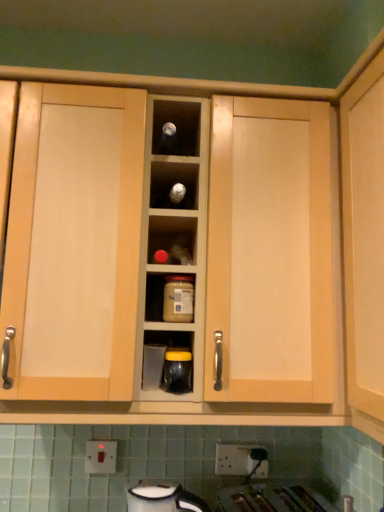
Question: From a real-world perspective, is matte plastic container at center, arranged as the second appliance when ordered from the bottom, on white plastic electric outlet at lower center, which appears as the 2th electric outlet when viewed from the left?

Choices:
 (A) no
 (B) yes

Answer: (B)

Question: Is matte plastic container at center, arranged as the second appliance when ordered from the bottom, completely or partially outside of white plastic electric outlet at lower center, which appears as the first electric outlet when viewed from the right?

Choices:
 (A) yes
 (B) no

Answer: (A)

Question: Is white plastic electric outlet at lower center, which appears as the 2th electric outlet when viewed from the left, completely or partially inside matte plastic container at center, arranged as the second appliance when ordered from the bottom?

Choices:
 (A) yes
 (B) no

Answer: (B)

Question: Does matte plastic container at center, arranged as the second appliance when ordered from the bottom, have a lesser height compared to white plastic electric outlet at lower center, which appears as the first electric outlet when viewed from the right?

Choices:
 (A) no
 (B) yes

Answer: (A)

Question: Are matte plastic container at center, arranged as the second appliance when ordered from the bottom, and white plastic electric outlet at lower center, which appears as the first electric outlet when viewed from the right, far apart?

Choices:
 (A) no
 (B) yes

Answer: (A)

Question: Considering the relative sizes of matte plastic container at center, the 2th appliance viewed from the top, and white plastic electric outlet at lower center, which appears as the first electric outlet when viewed from the right, in the image provided, is matte plastic container at center, the 2th appliance viewed from the top, bigger than white plastic electric outlet at lower center, which appears as the first electric outlet when viewed from the right,?

Choices:
 (A) no
 (B) yes

Answer: (B)

Question: Is light wood cabinet at center aimed at white glossy kettle at lower center, the third appliance in the top-to-bottom sequence?

Choices:
 (A) no
 (B) yes

Answer: (A)

Question: From the image's perspective, would you say light wood cabinet at center is shown under white glossy kettle at lower center, the third appliance in the top-to-bottom sequence?

Choices:
 (A) no
 (B) yes

Answer: (A)

Question: Is light wood cabinet at center positioned in front of white glossy kettle at lower center, the third appliance in the top-to-bottom sequence?

Choices:
 (A) yes
 (B) no

Answer: (A)

Question: Can you confirm if light wood cabinet at center is positioned to the left of white glossy kettle at lower center, placed as the 1th appliance when sorted from bottom to top?

Choices:
 (A) yes
 (B) no

Answer: (B)

Question: Considering the relative sizes of light wood cabinet at center and white glossy kettle at lower center, placed as the 1th appliance when sorted from bottom to top, in the image provided, is light wood cabinet at center taller than white glossy kettle at lower center, placed as the 1th appliance when sorted from bottom to top,?

Choices:
 (A) yes
 (B) no

Answer: (A)

Question: Is light wood cabinet at center thinner than white glossy kettle at lower center, the third appliance in the top-to-bottom sequence?

Choices:
 (A) yes
 (B) no

Answer: (A)

Question: From the image's perspective, is white plastic electric outlet at lower center, which appears as the 2th electric outlet when viewed from the left, over matte glass jar at center?

Choices:
 (A) no
 (B) yes

Answer: (A)